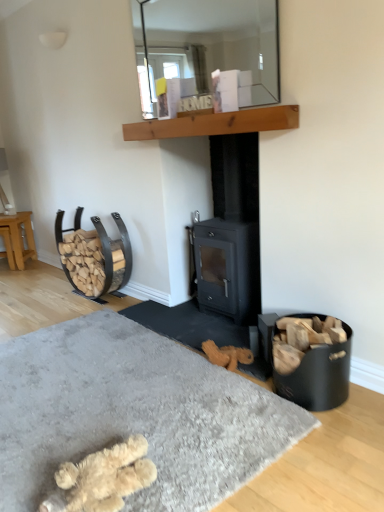
Question: Considering the positions of fuzzy beige slippers at lower left and light brown wooden stool at left in the image, is fuzzy beige slippers at lower left wider or thinner than light brown wooden stool at left?

Choices:
 (A) wide
 (B) thin

Answer: (A)

Question: Considering the positions of point (81, 498) and point (29, 244), is point (81, 498) closer or farther from the camera than point (29, 244)?

Choices:
 (A) farther
 (B) closer

Answer: (B)

Question: Which of these objects is positioned farthest from the black matte wood burning stove at center?

Choices:
 (A) fuzzy beige slippers at lower left
 (B) fluffy beige slippers at lower center
 (C) clear glass mirror at upper center
 (D) wooden at upper center
 (E) light brown wooden stool at left

Answer: (E)

Question: Estimate the real-world distances between objects in this image. Which object is farther from the wooden at upper center?

Choices:
 (A) fuzzy beige slippers at lower left
 (B) light brown wooden stool at left
 (C) clear glass mirror at upper center
 (D) black matte wood burning stove at center
 (E) fluffy beige slippers at lower center

Answer: (B)